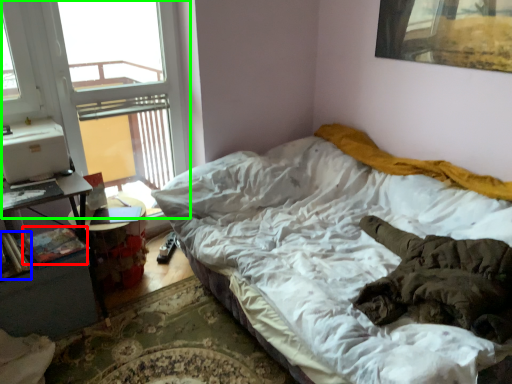
Question: Which object is positioned closest to book (highlighted by a red box)? Select from book (highlighted by a blue box) and window (highlighted by a green box).

Choices:
 (A) book
 (B) window

Answer: (A)